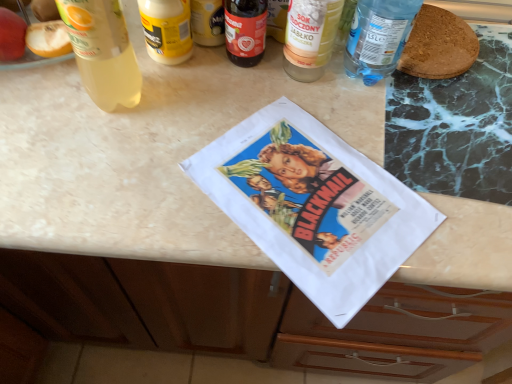
Question: Considering the relative sizes of yellow matte jar at upper center, marked as the second bottle in a left-to-right arrangement, and translucent plastic bottle at upper left, marked as the 1th bottle in a left-to-right arrangement, in the image provided, is yellow matte jar at upper center, marked as the second bottle in a left-to-right arrangement, taller than translucent plastic bottle at upper left, marked as the 1th bottle in a left-to-right arrangement,?

Choices:
 (A) no
 (B) yes

Answer: (A)

Question: Does yellow matte jar at upper center, the fourth bottle from the right, touch translucent plastic bottle at upper left, which is counted as the fifth bottle, starting from the right?

Choices:
 (A) yes
 (B) no

Answer: (A)

Question: Does yellow matte jar at upper center, the fourth bottle from the right, appear on the left side of translucent plastic bottle at upper left, which is counted as the fifth bottle, starting from the right?

Choices:
 (A) no
 (B) yes

Answer: (A)

Question: Could translucent plastic bottle at upper left, marked as the 1th bottle in a left-to-right arrangement, be considered to be inside yellow matte jar at upper center, marked as the second bottle in a left-to-right arrangement?

Choices:
 (A) yes
 (B) no

Answer: (B)

Question: Is yellow matte jar at upper center, marked as the second bottle in a left-to-right arrangement, further to the viewer compared to translucent plastic bottle at upper left, which is counted as the fifth bottle, starting from the right?

Choices:
 (A) yes
 (B) no

Answer: (A)

Question: From a real-world perspective, is yellow matte jar at upper center, the fourth bottle from the right, above or below translucent plastic bottle at upper left, which is counted as the fifth bottle, starting from the right?

Choices:
 (A) below
 (B) above

Answer: (A)

Question: Is yellow matte jar at upper center, the fourth bottle from the right, to the left or to the right of translucent plastic bottle at upper left, marked as the 1th bottle in a left-to-right arrangement, in the image?

Choices:
 (A) right
 (B) left

Answer: (A)

Question: Would you say yellow matte jar at upper center, the fourth bottle from the right, is inside or outside translucent plastic bottle at upper left, marked as the 1th bottle in a left-to-right arrangement?

Choices:
 (A) inside
 (B) outside

Answer: (B)

Question: Is yellow matte jar at upper center, the fourth bottle from the right, bigger or smaller than translucent plastic bottle at upper left, marked as the 1th bottle in a left-to-right arrangement?

Choices:
 (A) small
 (B) big

Answer: (A)

Question: In the image, is translucent plastic bottle at upper left, marked as the 1th bottle in a left-to-right arrangement, positioned in front of or behind translucent glass bottle at upper center, positioned as the 4th bottle in left-to-right order?

Choices:
 (A) behind
 (B) front

Answer: (B)

Question: Looking at the image, does translucent plastic bottle at upper left, which is counted as the fifth bottle, starting from the right, seem bigger or smaller compared to translucent glass bottle at upper center, which is counted as the 2th bottle, starting from the right?

Choices:
 (A) big
 (B) small

Answer: (A)

Question: From the image's perspective, is translucent plastic bottle at upper left, marked as the 1th bottle in a left-to-right arrangement, positioned above or below translucent glass bottle at upper center, which is counted as the 2th bottle, starting from the right?

Choices:
 (A) above
 (B) below

Answer: (B)

Question: Is translucent plastic bottle at upper left, marked as the 1th bottle in a left-to-right arrangement, wider or thinner than translucent glass bottle at upper center, positioned as the 4th bottle in left-to-right order?

Choices:
 (A) thin
 (B) wide

Answer: (B)

Question: Visually, is yellow matte jar at upper center, the fourth bottle from the right, positioned to the left or to the right of transparent plastic bottle at upper right, the 5th bottle in the left-to-right sequence?

Choices:
 (A) left
 (B) right

Answer: (A)

Question: Is yellow matte jar at upper center, the fourth bottle from the right, taller or shorter than transparent plastic bottle at upper right, the 5th bottle in the left-to-right sequence?

Choices:
 (A) tall
 (B) short

Answer: (B)